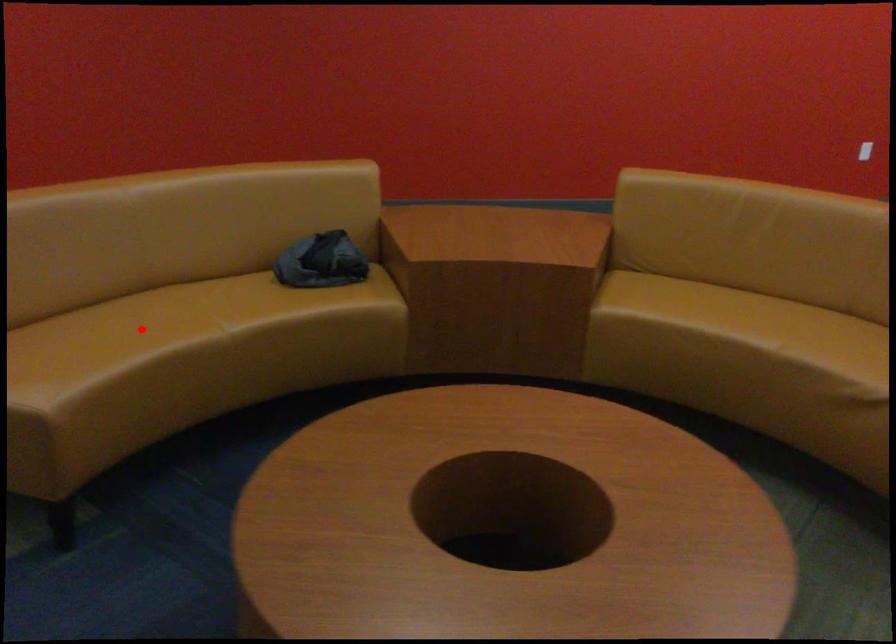
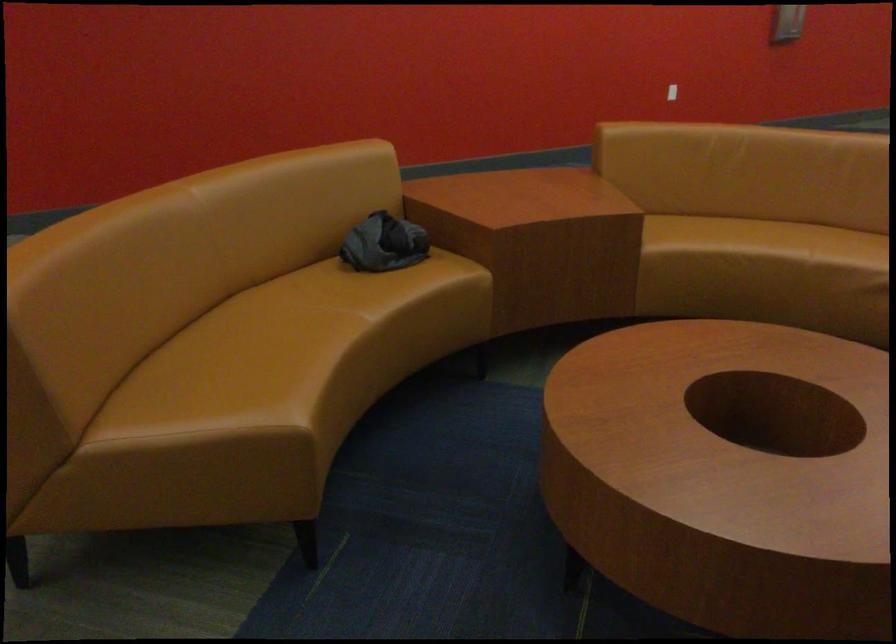
Where in the second image is the point corresponding to the highlighted location from the first image?

(271, 336)